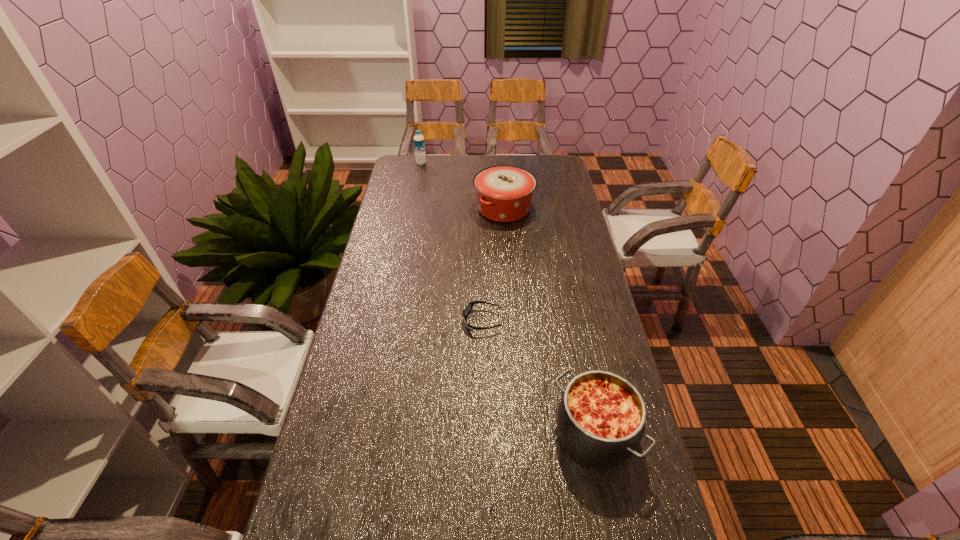
This screenshot has width=960, height=540. What are the coordinates of `object that is the second closest to the shortest object` in the screenshot? It's located at (504, 193).

You are a GUI agent. You are given a task and a screenshot of the screen. Output one action in this format:
    pyautogui.click(x=<x>, y=<y>)
    Task: Click on the object that is the third closest to the nearest object
    Image resolution: width=960 pixels, height=540 pixels.
    Given the screenshot: What is the action you would take?
    pyautogui.click(x=419, y=144)

Identify the location of free space that satisfies the following two spatial constraints: 1. on the lenses of the shorter casserole; 2. on the left side of the shortest object. (483, 434).

I want to click on vacant point that satisfies the following two spatial constraints: 1. on the back side of the farther casserole; 2. on the label of the water bottle, so click(x=501, y=164).

You are a GUI agent. You are given a task and a screenshot of the screen. Output one action in this format:
    pyautogui.click(x=<x>, y=<y>)
    Task: Click on the free spot that satisfies the following two spatial constraints: 1. on the lenses of the nearer casserole; 2. on the left side of the shortest object
    This screenshot has width=960, height=540.
    Given the screenshot: What is the action you would take?
    pyautogui.click(x=483, y=434)

What are the coordinates of `free spot that satisfies the following two spatial constraints: 1. on the label of the leftmost object; 2. on the back side of the nearest object` in the screenshot? It's located at (369, 434).

Find the location of a particular element. The width and height of the screenshot is (960, 540). vacant space that satisfies the following two spatial constraints: 1. on the label of the third nearest object; 2. on the right side of the farthest object is located at coordinates (413, 208).

Locate an element on the screen. The height and width of the screenshot is (540, 960). vacant space that satisfies the following two spatial constraints: 1. on the front side of the farther casserole; 2. on the lenses of the second nearest object is located at coordinates (512, 321).

At what (x,y) coordinates should I click in order to perform the action: click on free spot that satisfies the following two spatial constraints: 1. on the label of the leftmost object; 2. on the back side of the farther casserole. Please return your answer as a coordinate pair (x, y). Looking at the image, I should click on (413, 208).

Image resolution: width=960 pixels, height=540 pixels. Find the location of `free space in the image that satisfies the following two spatial constraints: 1. on the label of the farthest object; 2. on the back side of the third nearest object`. free space in the image that satisfies the following two spatial constraints: 1. on the label of the farthest object; 2. on the back side of the third nearest object is located at coordinates (413, 208).